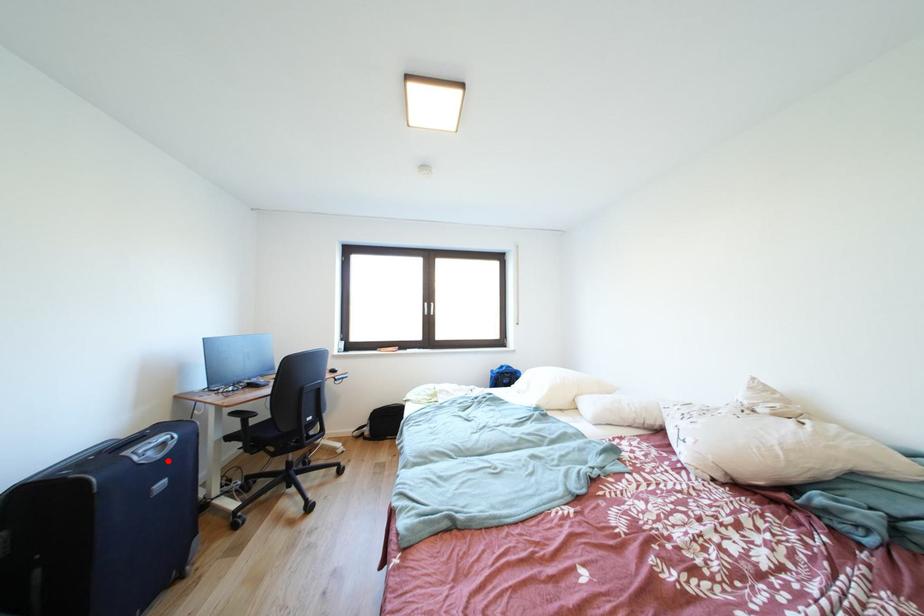
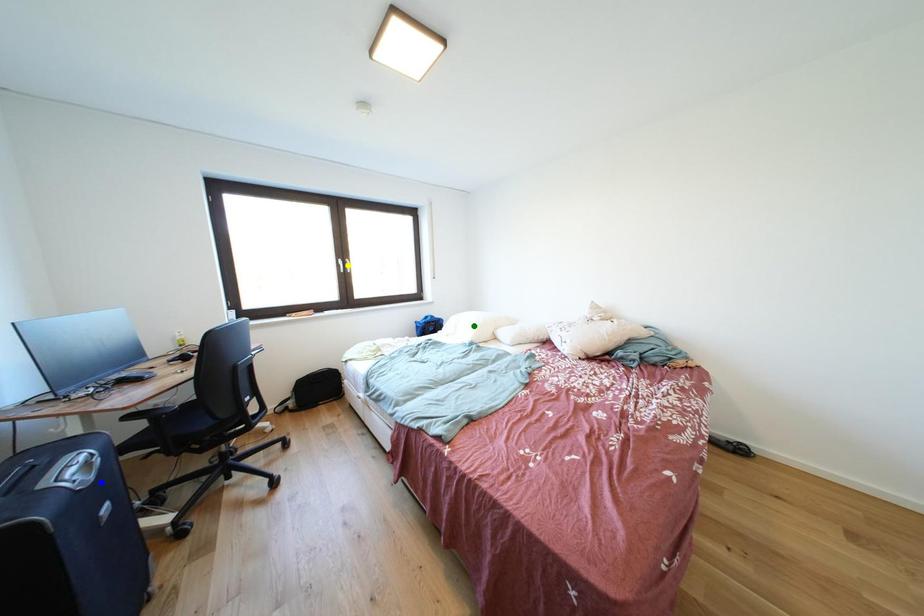
Question: I am providing you with two images of the same scene from different viewpoints. A red point is marked on the first image. You are given multiple points on the second image. Which point in image 2 is actually the same real-world point as the red point in image 1?

Choices:
 (A) blue point
 (B) green point
 (C) yellow point

Answer: (A)